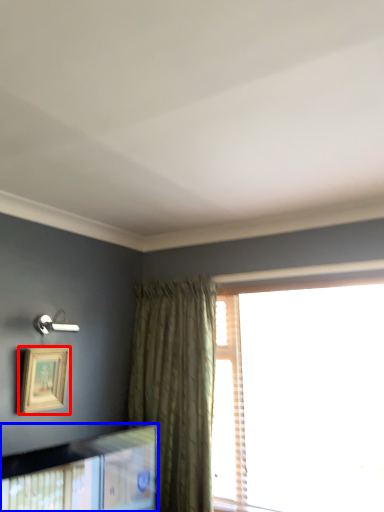
Question: Which point is further to the camera, picture frame (highlighted by a red box) or picture frame (highlighted by a blue box)?

Choices:
 (A) picture frame
 (B) picture frame

Answer: (A)